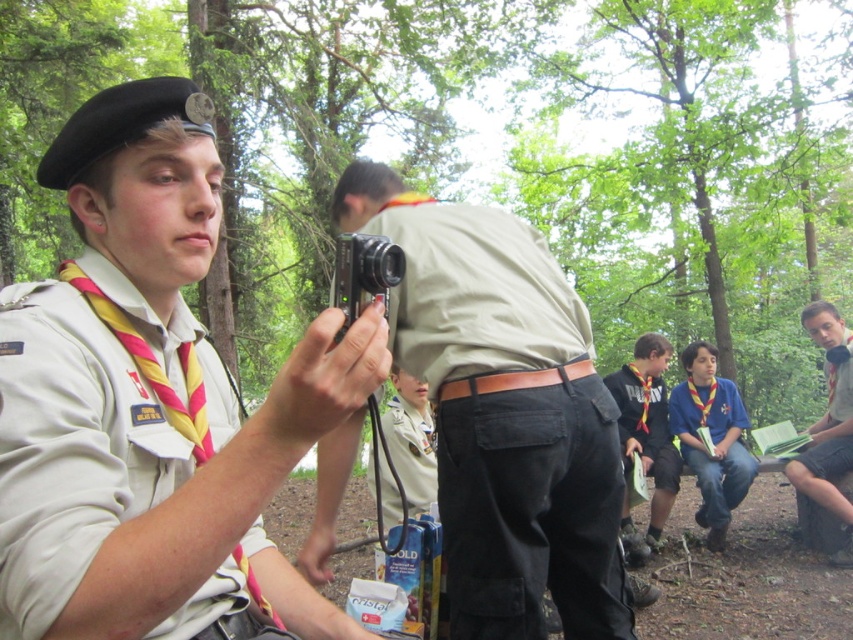
Image resolution: width=853 pixels, height=640 pixels. What do you see at coordinates (68, 449) in the screenshot?
I see `white cotton shirt at left` at bounding box center [68, 449].

Is white cotton shirt at left wider than light gray cotton shirt at right?

Incorrect, white cotton shirt at left's width does not surpass light gray cotton shirt at right's.

Locate an element on the screen. white cotton shirt at left is located at coordinates (68, 449).

Locate an element on the screen. The height and width of the screenshot is (640, 853). white cotton shirt at left is located at coordinates point(68,449).

Who is positioned more to the right, khaki fabric shirt at center or black plastic camera at center?

Positioned to the right is khaki fabric shirt at center.

Where is `khaki fabric shirt at center`? The image size is (853, 640). khaki fabric shirt at center is located at coordinates (503, 413).

Between point (604, 628) and point (392, 257), which one is positioned behind?

The point (604, 628) is more distant.

The height and width of the screenshot is (640, 853). What are the coordinates of `khaki fabric shirt at center` in the screenshot? It's located at (503, 413).

Is white cotton shirt at left in front of light blue denim jeans at lower right?

Yes.

Is white cotton shirt at left further to the viewer compared to light blue denim jeans at lower right?

No, white cotton shirt at left is in front of light blue denim jeans at lower right.

This screenshot has height=640, width=853. In order to click on white cotton shirt at left in this screenshot , I will do `click(68, 449)`.